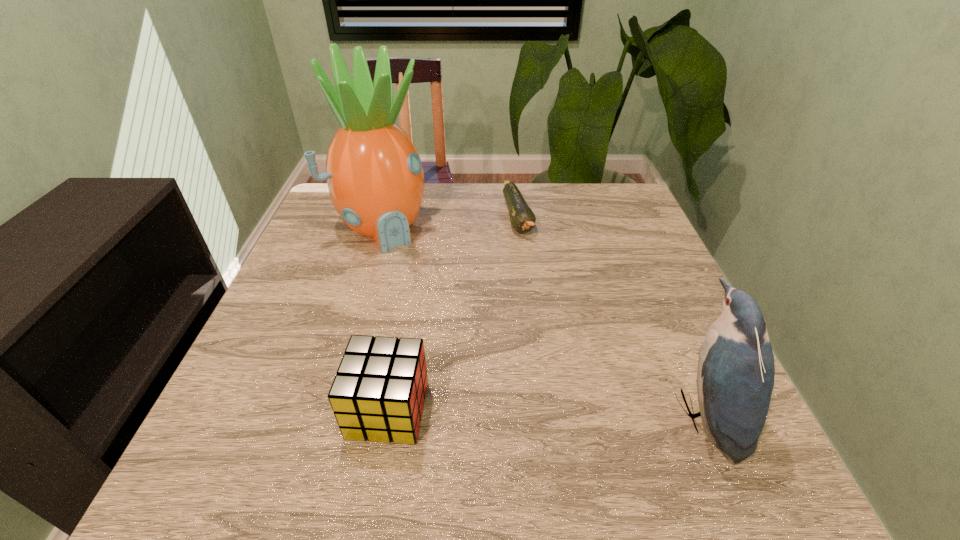
Find the location of a particular element. This screenshot has width=960, height=540. free point between the second shortest object and the pineapple is located at coordinates (385, 318).

At what (x,y) coordinates should I click in order to perform the action: click on unoccupied position between the pineapple and the second tallest object. Please return your answer as a coordinate pair (x, y). This screenshot has height=540, width=960. Looking at the image, I should click on (541, 319).

Find the location of a particular element. The height and width of the screenshot is (540, 960). empty location between the pineapple and the shortest object is located at coordinates (450, 221).

Where is `vacant area that lies between the bird and the third tallest object`? The height and width of the screenshot is (540, 960). vacant area that lies between the bird and the third tallest object is located at coordinates (545, 411).

Identify the location of free space between the zucchini and the tallest object. This screenshot has height=540, width=960. (450, 221).

Image resolution: width=960 pixels, height=540 pixels. I want to click on empty location between the pineapple and the zucchini, so click(450, 221).

You are a GUI agent. You are given a task and a screenshot of the screen. Output one action in this format:
    pyautogui.click(x=<x>, y=<y>)
    Task: Click on the free space between the shortest object and the tallest object
    
    Given the screenshot: What is the action you would take?
    pyautogui.click(x=450, y=221)

I want to click on free space between the rightmost object and the second shortest object, so click(x=545, y=411).

Where is `free space between the third tallest object and the third shortest object`? free space between the third tallest object and the third shortest object is located at coordinates (545, 411).

You are a GUI agent. You are given a task and a screenshot of the screen. Output one action in this format:
    pyautogui.click(x=<x>, y=<y>)
    Task: Click on the vacant area between the rightmost object and the third object from left to right
    
    Given the screenshot: What is the action you would take?
    pyautogui.click(x=610, y=315)